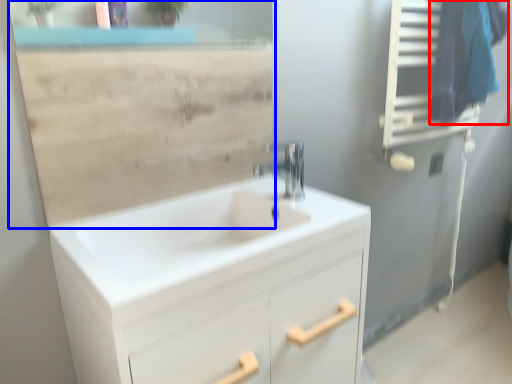
Question: Which object is further to the camera taking this photo, laundry (highlighted by a red box) or mirror (highlighted by a blue box)?

Choices:
 (A) laundry
 (B) mirror

Answer: (A)